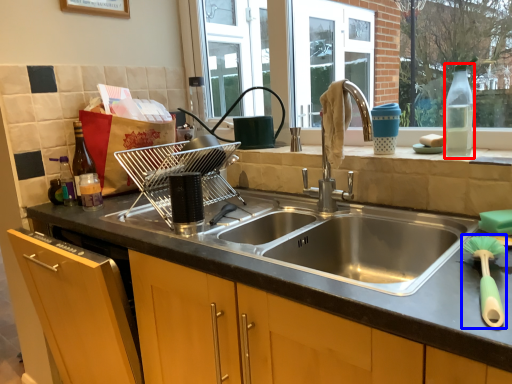
Question: Among these objects, which one is farthest to the camera, bottle (highlighted by a red box) or brush (highlighted by a blue box)?

Choices:
 (A) bottle
 (B) brush

Answer: (A)